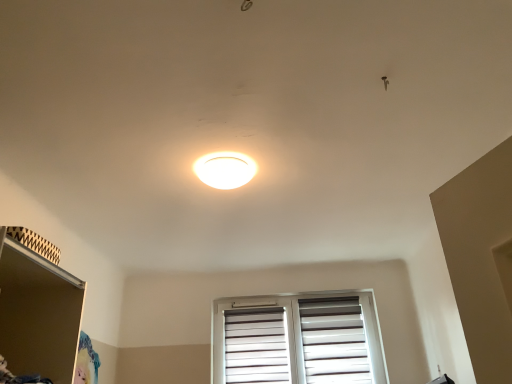
Question: Is point (227, 170) closer or farther from the camera than point (69, 304)?

Choices:
 (A) closer
 (B) farther

Answer: (B)

Question: From the image's perspective, is white glossy ceiling light at center positioned above or below matte brown shelf at lower left?

Choices:
 (A) below
 (B) above

Answer: (B)

Question: Based on their relative distances, which object is nearer to the matte brown shelf at lower left?

Choices:
 (A) white glossy ceiling light at center
 (B) white matte window at center

Answer: (A)

Question: Estimate the real-world distances between objects in this image. Which object is closer to the white glossy ceiling light at center?

Choices:
 (A) white matte window at center
 (B) matte brown shelf at lower left

Answer: (B)